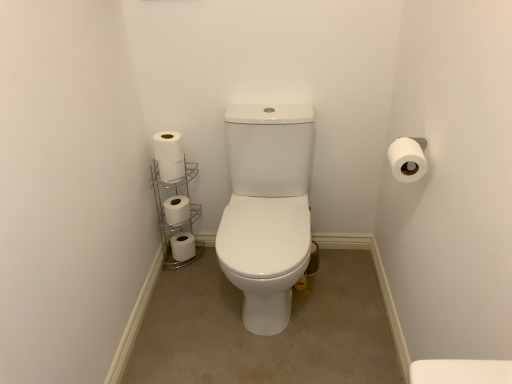
Question: Is white matte toilet paper at left, acting as the fourth toilet paper starting from the bottom, closer to camera compared to white metallic toilet paper holder at lower left?

Choices:
 (A) yes
 (B) no

Answer: (A)

Question: Is white matte toilet paper at left, which ranks as the fourth toilet paper in right-to-left order, aimed at white metallic toilet paper holder at lower left?

Choices:
 (A) no
 (B) yes

Answer: (A)

Question: Is white matte toilet paper at left, the 2th toilet paper when ordered from top to bottom, taller than white metallic toilet paper holder at lower left?

Choices:
 (A) no
 (B) yes

Answer: (A)

Question: From the image's perspective, is white matte toilet paper at left, acting as the third toilet paper starting from the back, above white metallic toilet paper holder at lower left?

Choices:
 (A) no
 (B) yes

Answer: (B)

Question: Considering the relative positions of white matte toilet paper at left, acting as the fourth toilet paper starting from the bottom, and white metallic toilet paper holder at lower left in the image provided, is white matte toilet paper at left, acting as the fourth toilet paper starting from the bottom, to the right of white metallic toilet paper holder at lower left from the viewer's perspective?

Choices:
 (A) yes
 (B) no

Answer: (B)

Question: Does white matte toilet paper at left, which is the 2th toilet paper in left-to-right order, have a lesser height compared to white metallic toilet paper holder at lower left?

Choices:
 (A) yes
 (B) no

Answer: (A)

Question: Does white matte toilet paper at center-left, positioned as the 4th toilet paper in front-to-back order, have a smaller size compared to white matte toilet paper at upper right, marked as the 3th toilet paper in a top-to-bottom arrangement?

Choices:
 (A) yes
 (B) no

Answer: (B)

Question: Considering the relative sizes of white matte toilet paper at center-left, marked as the 1th toilet paper in a left-to-right arrangement, and white matte toilet paper at upper right, which is counted as the 1th toilet paper, starting from the front, in the image provided, is white matte toilet paper at center-left, marked as the 1th toilet paper in a left-to-right arrangement, taller than white matte toilet paper at upper right, which is counted as the 1th toilet paper, starting from the front,?

Choices:
 (A) no
 (B) yes

Answer: (B)

Question: From the image's perspective, is white matte toilet paper at center-left, marked as the 2th toilet paper in a bottom-to-top arrangement, under white matte toilet paper at upper right, which is counted as the 1th toilet paper, starting from the front?

Choices:
 (A) no
 (B) yes

Answer: (B)

Question: Is white matte toilet paper at center-left, which is the 2th toilet paper from back to front, behind white matte toilet paper at upper right, marked as the 3th toilet paper in a top-to-bottom arrangement?

Choices:
 (A) no
 (B) yes

Answer: (B)

Question: Is white matte toilet paper at center-left, which ranks as the fourth toilet paper in top-to-bottom order, shorter than white matte toilet paper at upper right, which is counted as the 1th toilet paper, starting from the front?

Choices:
 (A) yes
 (B) no

Answer: (B)

Question: Is white matte toilet paper at center-left, which is the 2th toilet paper from back to front, looking in the opposite direction of white matte toilet paper at upper right, which is counted as the 1th toilet paper, starting from the front?

Choices:
 (A) no
 (B) yes

Answer: (A)

Question: Is white matte toilet paper at left, which is the 2th toilet paper from front to back, to the right of white metallic toilet paper holder at lower left from the viewer's perspective?

Choices:
 (A) no
 (B) yes

Answer: (B)